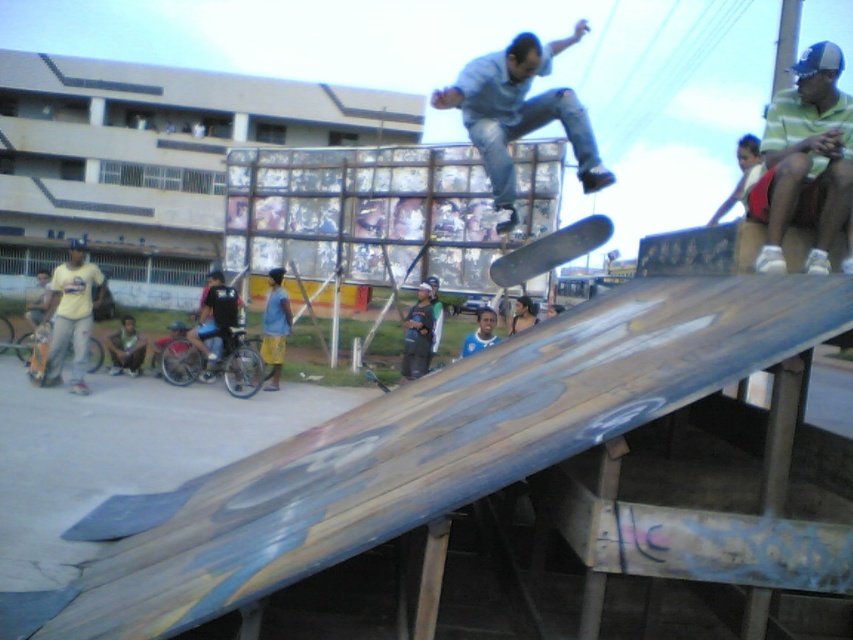
You are a photographer trying to capture both the smooth black skateboard at center and the wooden skateboard at lower left in a single shot. Which skateboard should you focus on first to ensure both are in frame?

The smooth black skateboard at center is positioned on the right side of wooden skateboard at lower left. Therefore, you should focus on the wooden skateboard at lower left first, as it is on the left side, allowing you to frame both objects from left to right.

You are a photographer positioned at the base of the ramp. You want to take a photo that includes both the striped green and white shirt at upper right and the matte yellow shirt at left. Which shirt will appear smaller in the photo?

The striped green and white shirt at upper right will appear smaller in the photo because it has a lesser height compared to the matte yellow shirt at left.